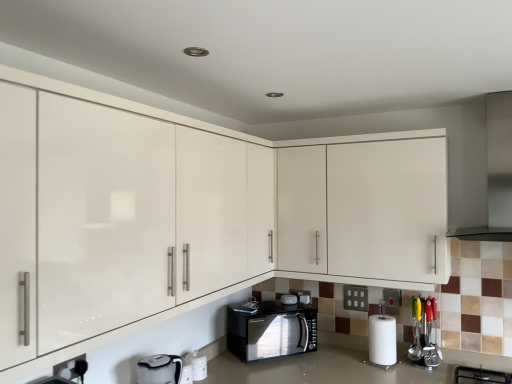
You are a GUI agent. You are given a task and a screenshot of the screen. Output one action in this format:
    pyautogui.click(x=<x>, y=<y>)
    Task: Click on the vacant space situated above satin silver exhaust hood at upper right (from a real-world perspective)
    Image resolution: width=512 pixels, height=384 pixels.
    Given the screenshot: What is the action you would take?
    pyautogui.click(x=483, y=90)